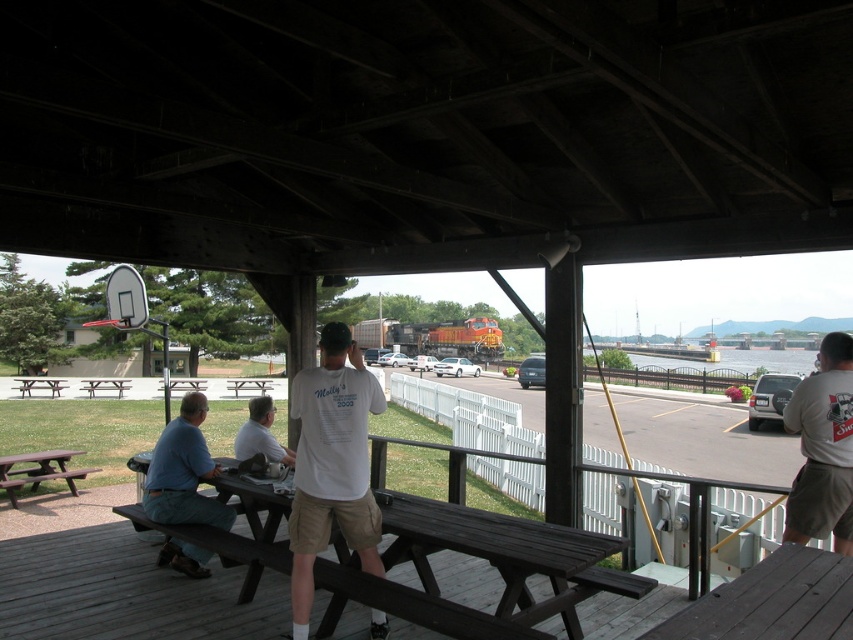
You are standing at the center of the wooden pavilion and want to greet the person wearing the blue cotton shirt at lower left. In which direction should you walk to reach them?

The blue cotton shirt at lower left is located at point (183, 472), which means you should walk towards the lower left direction from the center of the pavilion to reach them.

You are standing at the wooden pavilion and want to locate two specific points marked in the image. Which of the two points, point 1 at coordinates point [190,442] or point 2 at coordinates point [61,458], is closer to you?

Point 1 at coordinates point [190,442] is closer to the viewer than point 2 at coordinates point [61,458].